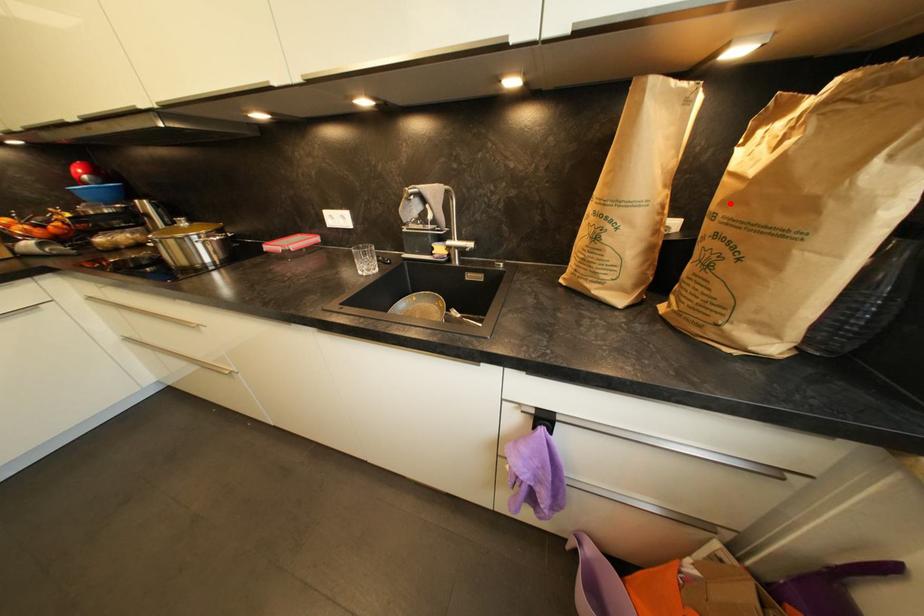
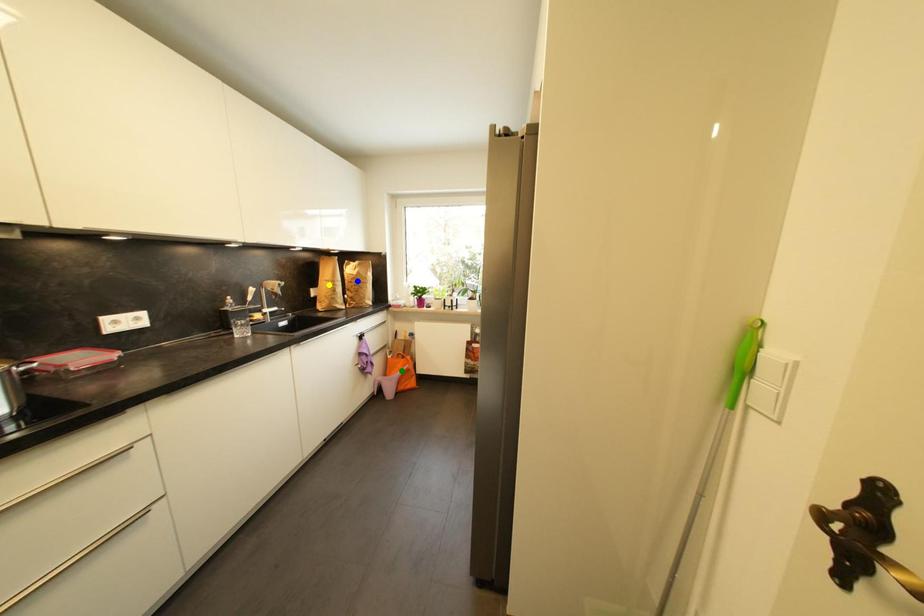
Question: I am providing you with two images of the same scene from different viewpoints. A red point is marked on the first image. You are given multiple points on the second image. Can you choose the point in image 2 that corresponds to the point in image 1?

Choices:
 (A) green point
 (B) yellow point
 (C) blue point

Answer: (C)